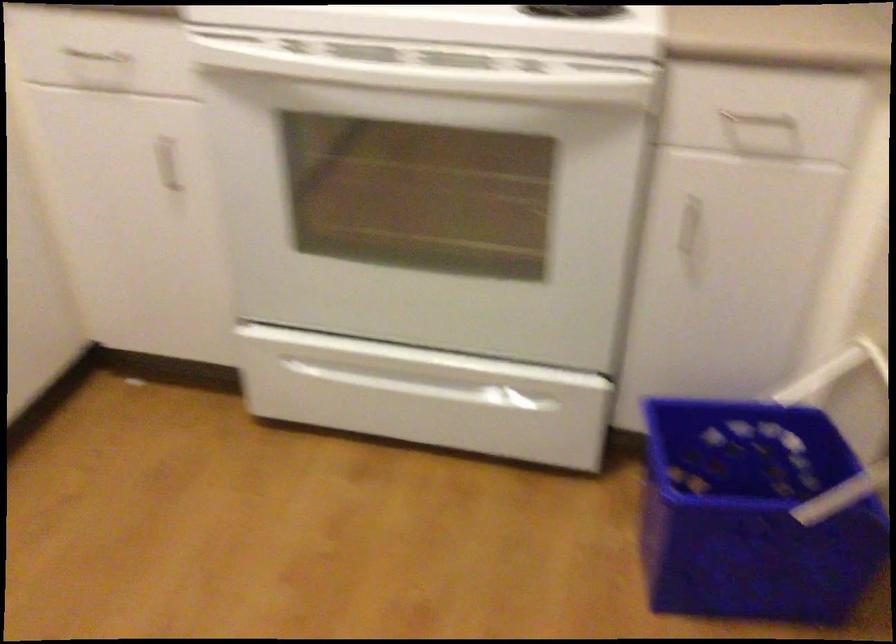
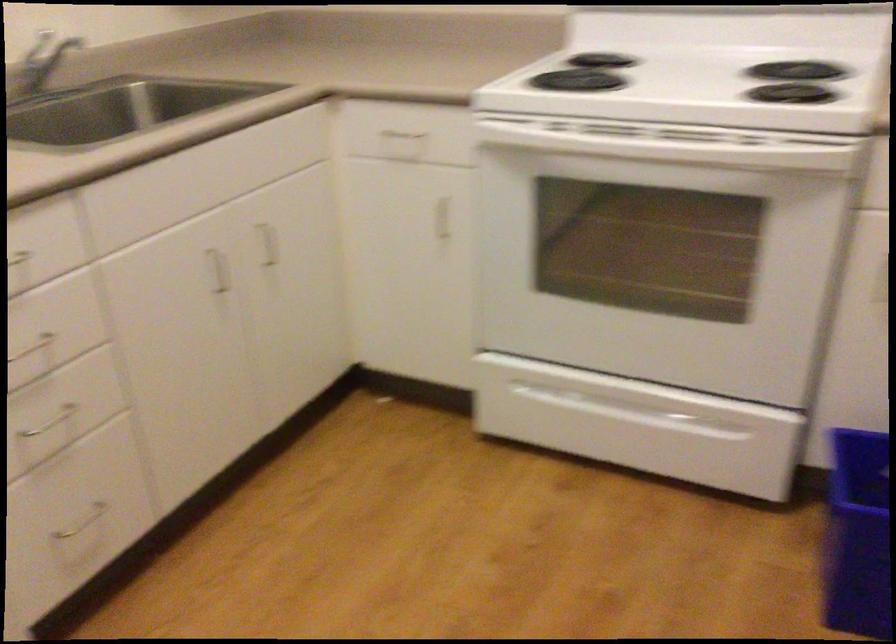
Question: The camera is either moving clockwise (left) or counter-clockwise (right) around the object. The first image is from the beginning of the video and the second image is from the end. Is the camera moving left or right when shooting the video?

Choices:
 (A) Left
 (B) Right

Answer: (B)